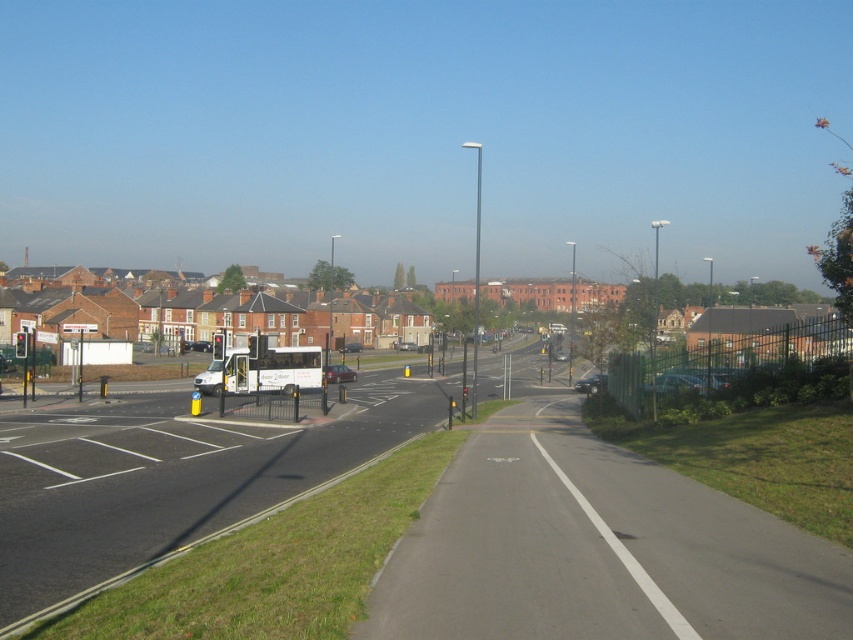
Question: Can you confirm if metallic silver car at right is bigger than white matte van at center-left?

Choices:
 (A) yes
 (B) no

Answer: (B)

Question: Which is farther from the matte black car at center?

Choices:
 (A) metallic silver car at right
 (B) metallic silver car at center

Answer: (A)

Question: Is white matte van at center bigger than matte black car at center?

Choices:
 (A) yes
 (B) no

Answer: (B)

Question: Among these points, which one is farthest from the camera?

Choices:
 (A) (601, 381)
 (B) (351, 380)
 (C) (210, 371)

Answer: (B)

Question: Considering the real-world distances, which object is farthest from the matte white bus at center?

Choices:
 (A) matte black car at center
 (B) metallic silver car at center

Answer: (B)

Question: Where is metallic silver car at right located in relation to matte black car at center in the image?

Choices:
 (A) left
 (B) right

Answer: (B)